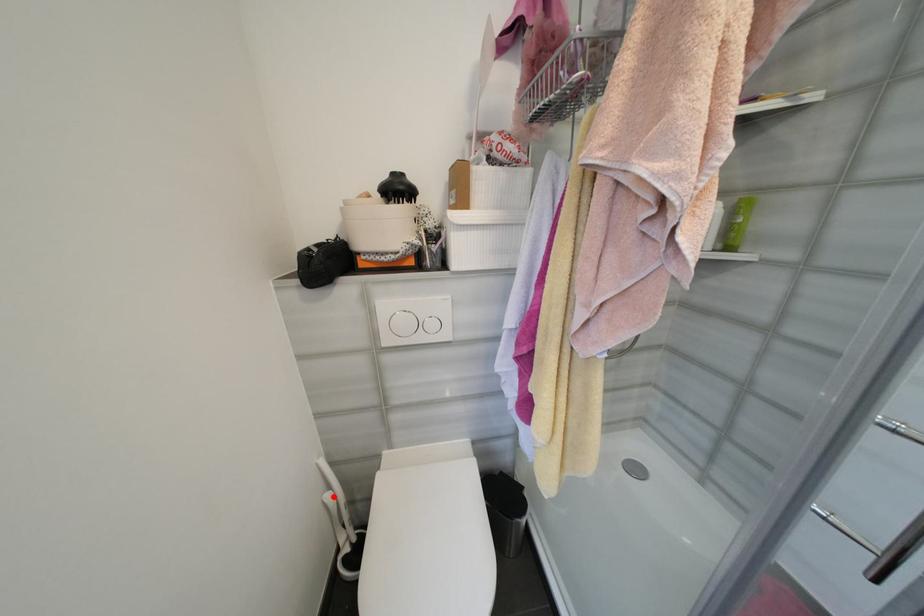
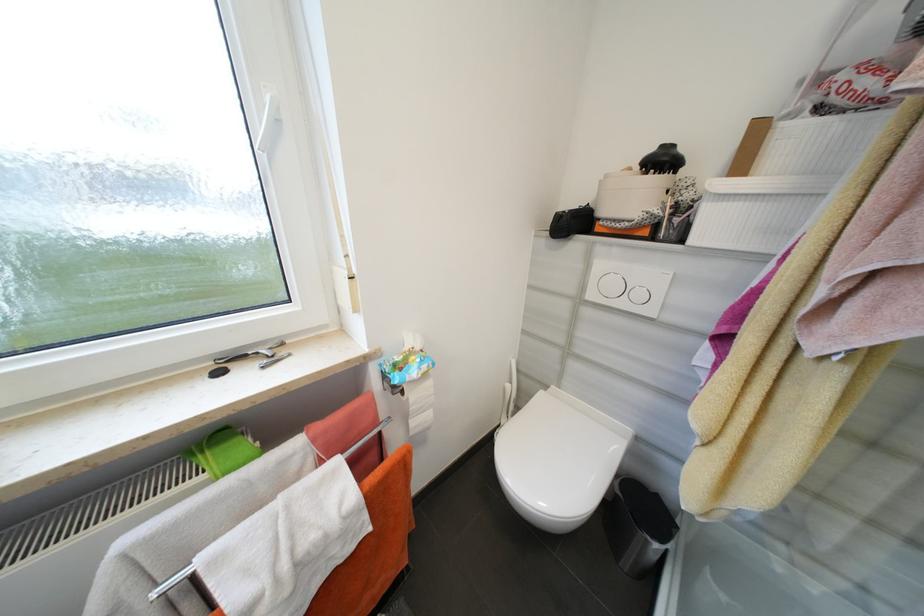
The point at the highlighted location is marked in the first image. Where is the corresponding point in the second image?

(514, 387)